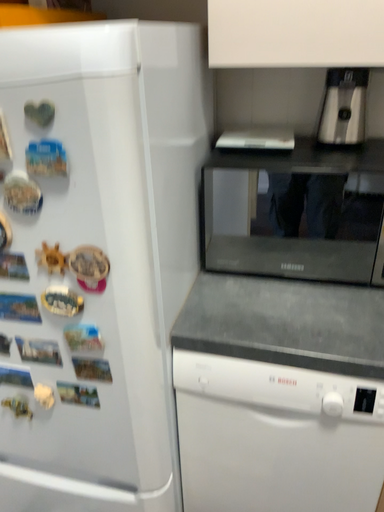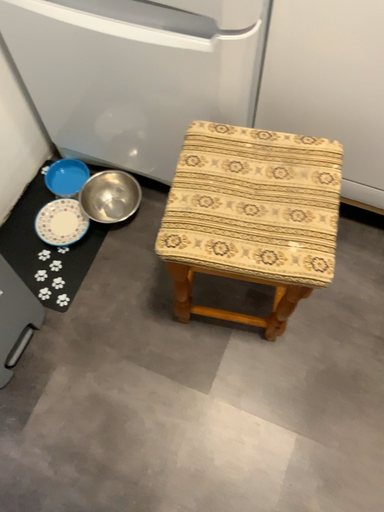
Question: How did the camera likely rotate when shooting the video?

Choices:
 (A) rotated downward
 (B) rotated upward

Answer: (A)